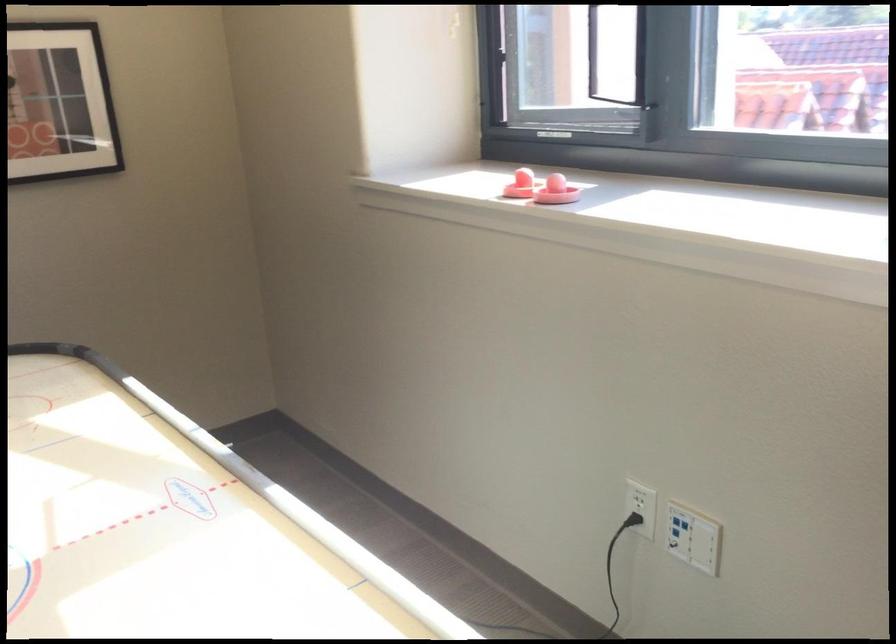
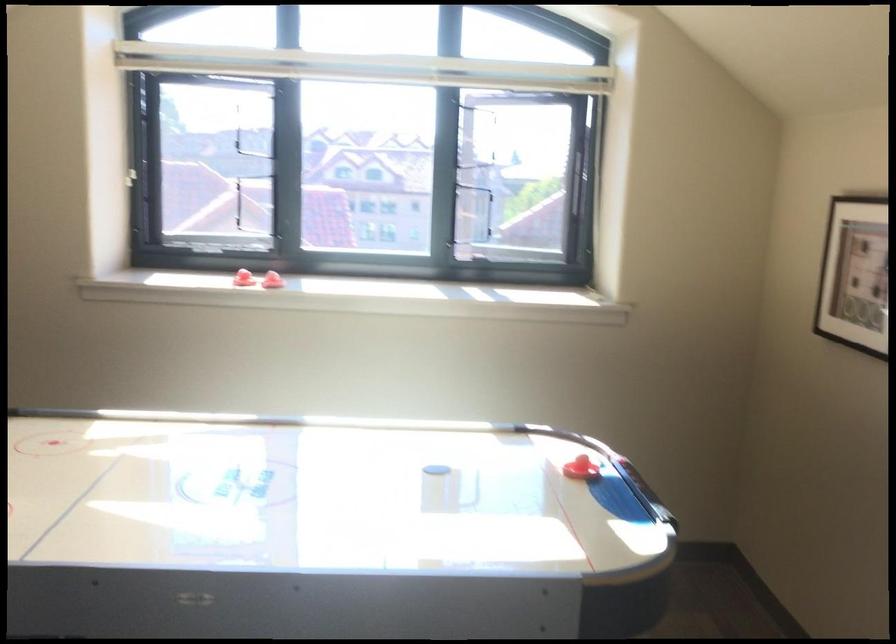
Question: I am providing you with two images of the same scene from different viewpoints. Which of the following objects are not visible in image2?

Choices:
 (A) black air hockey puck
 (B) grey towel rack
 (C) window latch
 (D) white wall button

Answer: (D)